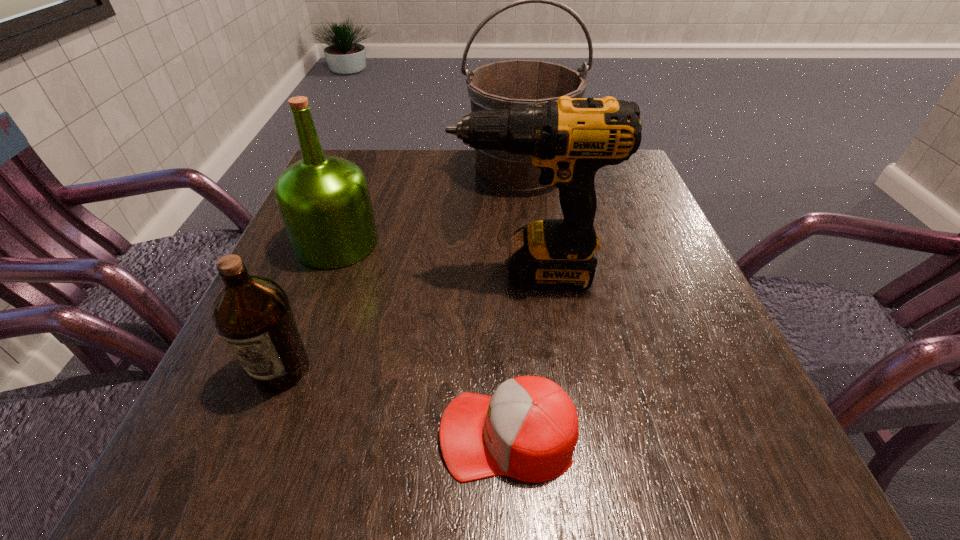
At what (x,y) coordinates should I click in order to perform the action: click on the farthest object. Please return your answer as a coordinate pair (x, y). The width and height of the screenshot is (960, 540). Looking at the image, I should click on (496, 86).

Find the location of `drill`. drill is located at coordinates tap(569, 139).

You are a GUI agent. You are given a task and a screenshot of the screen. Output one action in this format:
    pyautogui.click(x=<x>, y=<y>)
    Task: Click on the taller olive oil
    Image resolution: width=960 pixels, height=540 pixels.
    Given the screenshot: What is the action you would take?
    pyautogui.click(x=324, y=201)

The width and height of the screenshot is (960, 540). What are the coordinates of `the shorter olive oil` in the screenshot? It's located at (253, 315).

I want to click on the fourth tallest object, so click(x=253, y=315).

I want to click on the shortest object, so click(528, 430).

Find the location of `vacant region located on the left of the bucket`. vacant region located on the left of the bucket is located at coordinates (346, 174).

This screenshot has height=540, width=960. What are the coordinates of `vacant area located at the tip of the drill` in the screenshot? It's located at (383, 272).

This screenshot has width=960, height=540. I want to click on free location located at the tip of the drill, so click(372, 272).

The image size is (960, 540). What are the coordinates of `vacant space positioned at the tip of the drill` in the screenshot? It's located at (334, 272).